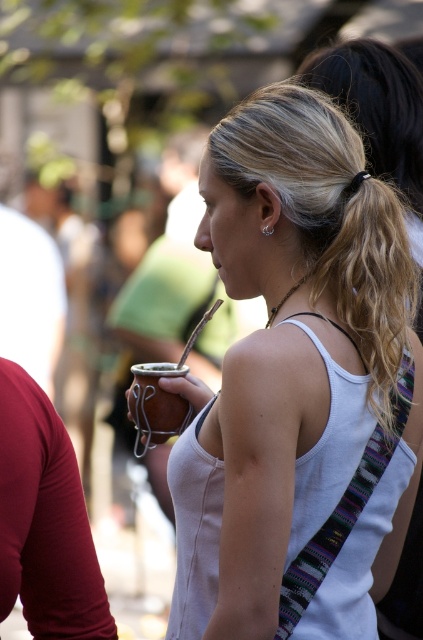
From the picture: Can you confirm if matte brown leather purse at center is thinner than matte brown cup at center?

Correct, matte brown leather purse at center's width is less than matte brown cup at center's.

Image resolution: width=423 pixels, height=640 pixels. What are the coordinates of `matte brown leather purse at center` in the screenshot? It's located at (299, 385).

Who is more distant from viewer, (x=192, y=314) or (x=170, y=372)?

The point (x=192, y=314) is behind.

Who is more forward, (203,307) or (180,397)?

Point (180,397) is more forward.

In order to click on matte brown cup at center in this screenshot , I will do `click(167, 285)`.

Is point (236, 621) positioned in front of point (172, 378)?

Yes, it is in front of point (172, 378).

Can you confirm if matte brown leather purse at center is taller than brown leather mate at center?

Yes, matte brown leather purse at center is taller than brown leather mate at center.

Image resolution: width=423 pixels, height=640 pixels. What do you see at coordinates (299, 385) in the screenshot?
I see `matte brown leather purse at center` at bounding box center [299, 385].

Locate an element on the screen. The height and width of the screenshot is (640, 423). matte brown leather purse at center is located at coordinates (299, 385).